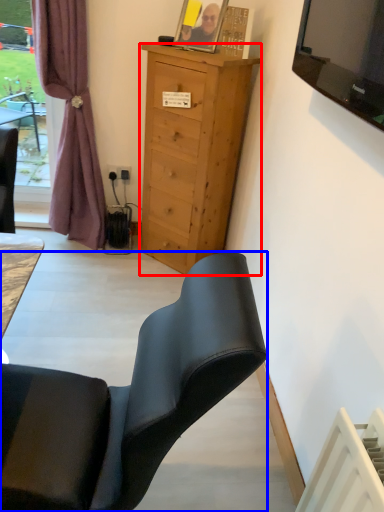
Question: Among these objects, which one is farthest to the camera, cabinetry (highlighted by a red box) or chair (highlighted by a blue box)?

Choices:
 (A) cabinetry
 (B) chair

Answer: (A)